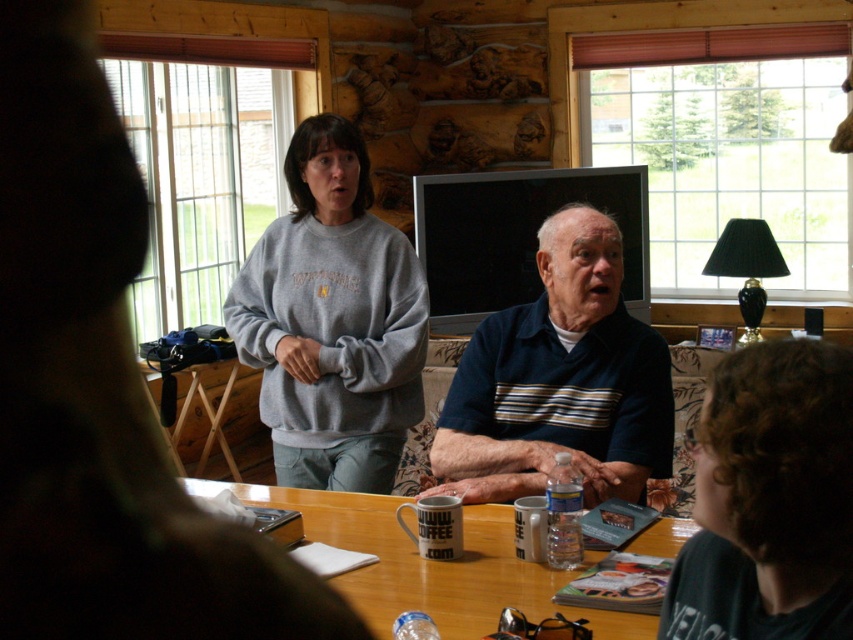
Question: Which point is farther to the camera?

Choices:
 (A) coord(534,461)
 (B) coord(349,289)

Answer: (B)

Question: Which object appears closest to the camera in this image?

Choices:
 (A) blue striped polo shirt at center
 (B) wooden table at center
 (C) gray sweatshirt at upper left

Answer: (B)

Question: Does gray sweatshirt at upper left appear on the right side of wooden table at center?

Choices:
 (A) yes
 (B) no

Answer: (B)

Question: Does gray sweatshirt at upper left appear on the right side of blue striped polo shirt at center?

Choices:
 (A) no
 (B) yes

Answer: (A)

Question: Is blue striped polo shirt at center in front of wooden table at center?

Choices:
 (A) no
 (B) yes

Answer: (A)

Question: Which of the following is the closest to the observer?

Choices:
 (A) wooden table at center
 (B) gray sweatshirt at upper left

Answer: (A)